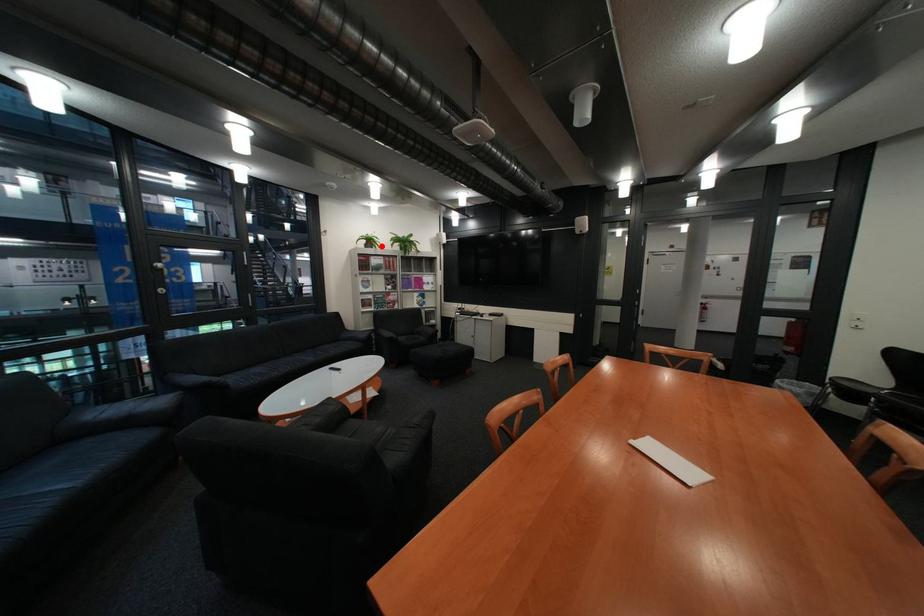
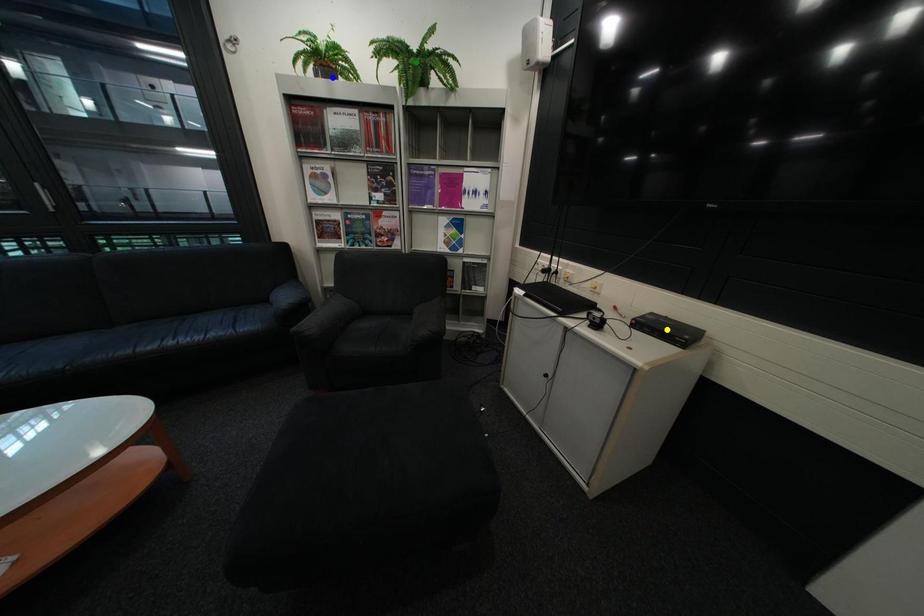
Question: I am providing you with two images of the same scene from different viewpoints. A red point is marked on the first image. You are given multiple points on the second image. Which point in image 2 represents the same 3d spot as the red point in image 1?

Choices:
 (A) green point
 (B) blue point
 (C) yellow point

Answer: (B)